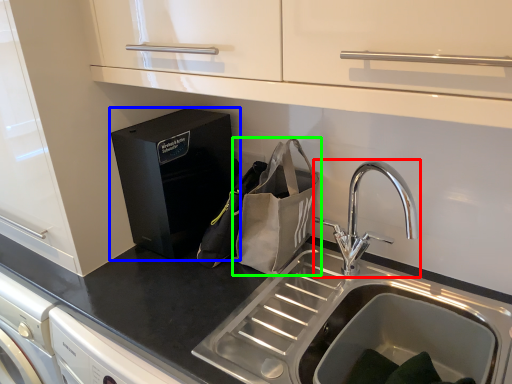
Question: Which object is positioned farthest from tap (highlighted by a red box)? Select from home appliance (highlighted by a blue box) and pouch (highlighted by a green box).

Choices:
 (A) home appliance
 (B) pouch

Answer: (A)